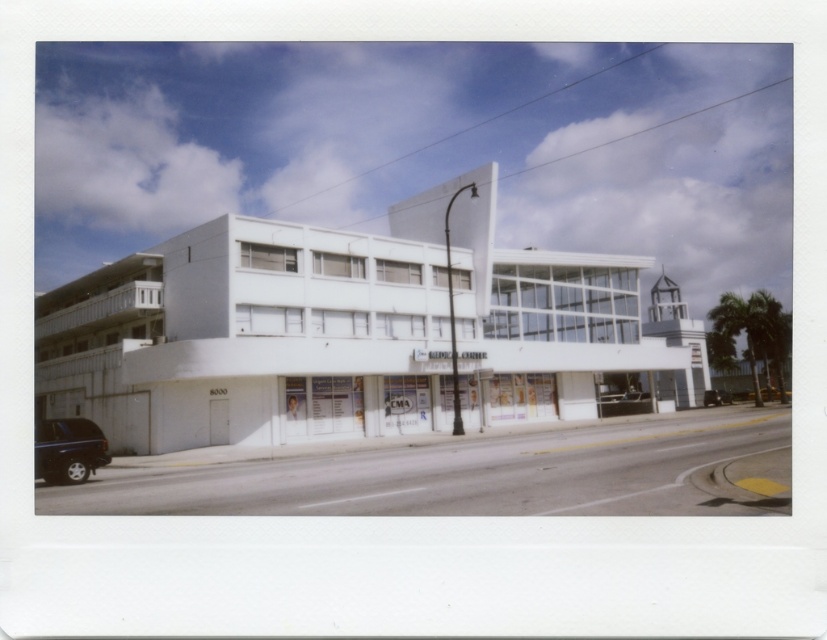
Can you confirm if shiny black suv at lower left is positioned above black rubber car at center?

Yes, shiny black suv at lower left is above black rubber car at center.

Looking at this image, measure the distance between point [85,419] and camera.

A distance of 114.37 feet exists between point [85,419] and camera.

Find the location of a particular element. shiny black suv at lower left is located at coordinates (68, 449).

Image resolution: width=827 pixels, height=640 pixels. I want to click on shiny black suv at lower left, so click(x=68, y=449).